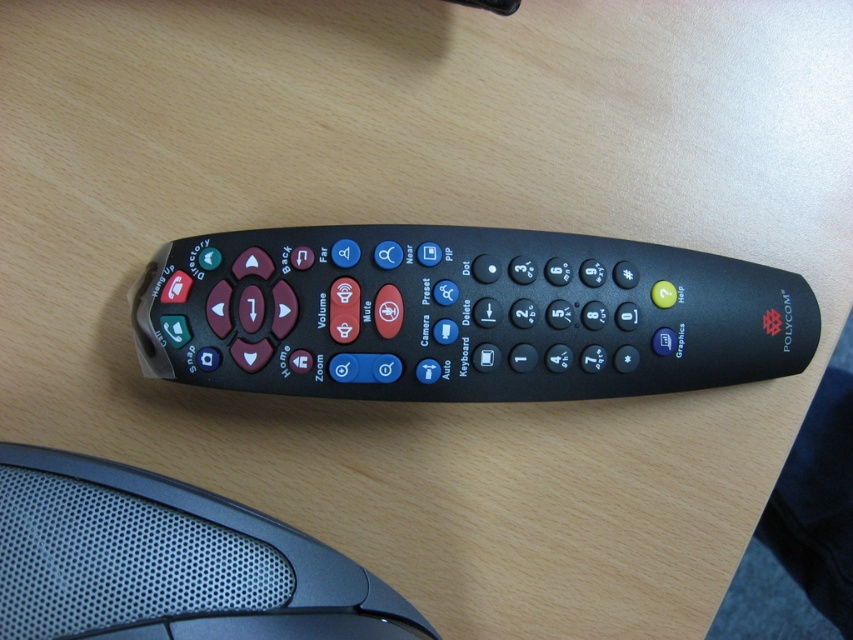
Question: Which object is farther from the camera taking this photo?

Choices:
 (A) black plastic remote at center
 (B) black textured mouse at lower left

Answer: (A)

Question: Can you confirm if black plastic remote at center is thinner than black textured mouse at lower left?

Choices:
 (A) yes
 (B) no

Answer: (B)

Question: Does black plastic remote at center have a lesser width compared to black textured mouse at lower left?

Choices:
 (A) no
 (B) yes

Answer: (A)

Question: Considering the relative positions of black plastic remote at center and black textured mouse at lower left in the image provided, where is black plastic remote at center located with respect to black textured mouse at lower left?

Choices:
 (A) right
 (B) left

Answer: (A)